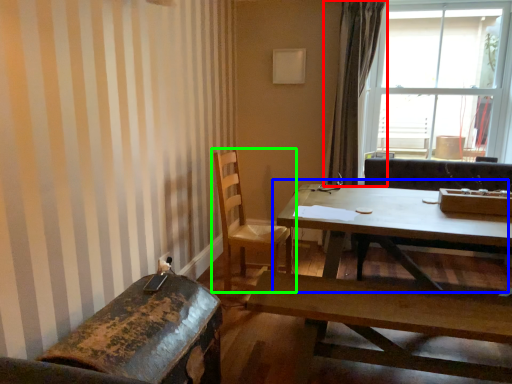
Question: Based on their relative distances, which object is nearer to curtain (highlighted by a red box)? Choose from coffee table (highlighted by a blue box) and chair (highlighted by a green box).

Choices:
 (A) coffee table
 (B) chair

Answer: (A)